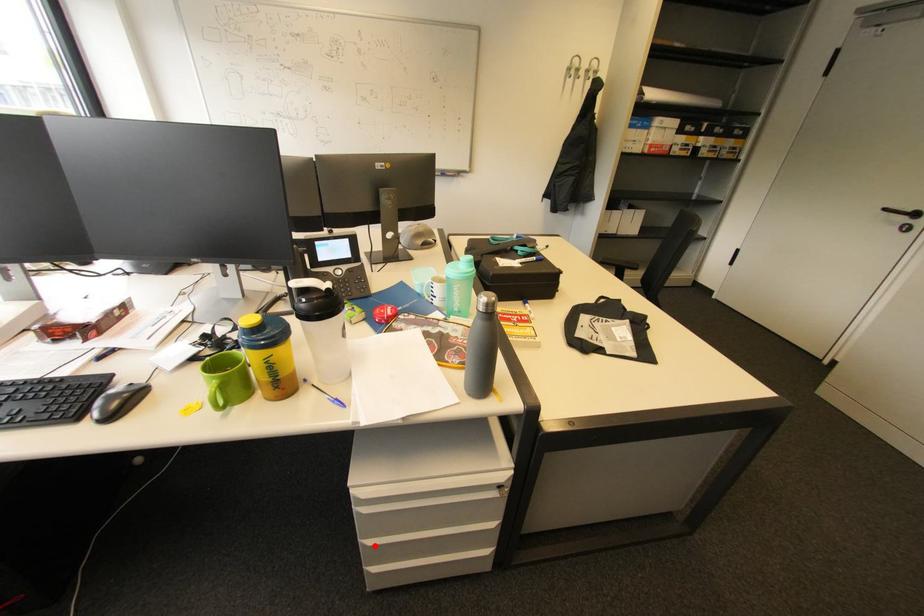
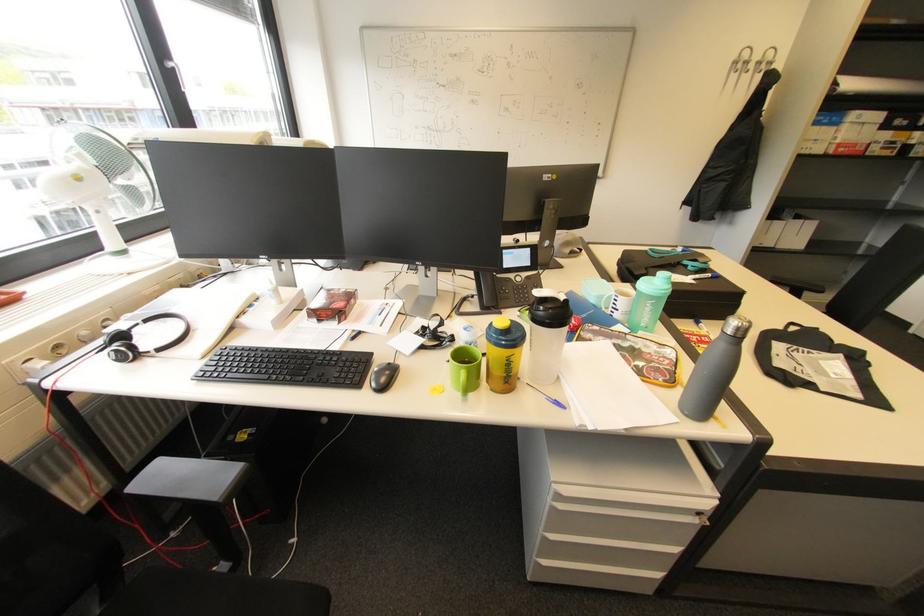
The point at the highlighted location is marked in the first image. Where is the corresponding point in the second image?

(555, 540)